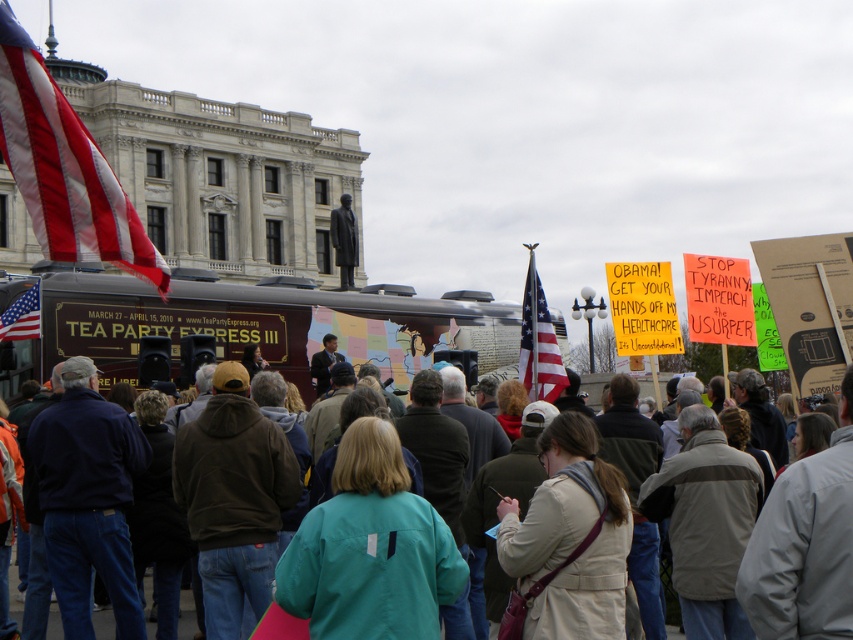
Question: Which object is positioned closest to the red-white-blue fabric flag at upper left?

Choices:
 (A) tan leather jacket at center
 (B) american flag at left
 (C) teal fabric jacket at center
 (D) brown vinyl food truck at center

Answer: (B)

Question: From the image, what is the correct spatial relationship of tan leather jacket at center in relation to green fabric jacket at center?

Choices:
 (A) left
 (B) right

Answer: (B)

Question: Can you confirm if teal fabric jacket at center is positioned to the right of american flag at left?

Choices:
 (A) no
 (B) yes

Answer: (B)

Question: Which point appears closest to the camera in this image?

Choices:
 (A) (140, 326)
 (B) (531, 376)

Answer: (A)

Question: Does red-white-blue fabric flag at upper left have a lesser width compared to american flag at left?

Choices:
 (A) yes
 (B) no

Answer: (B)

Question: Which of these objects is positioned closest to the red-white-blue fabric flag at upper left?

Choices:
 (A) green fabric jacket at center
 (B) american flag at center
 (C) teal fabric jacket at center
 (D) american flag at left

Answer: (D)